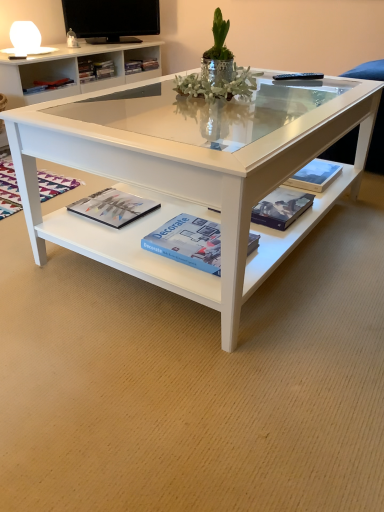
This screenshot has width=384, height=512. I want to click on matte black book at lower center, which is counted as the third magazine, starting from the left, so click(281, 208).

Describe the element at coordinates (190, 172) in the screenshot. Image resolution: width=384 pixels, height=512 pixels. I see `white glossy coffee table at center` at that location.

Where is `matte black book at center`? Image resolution: width=384 pixels, height=512 pixels. matte black book at center is located at coordinates pyautogui.click(x=47, y=85).

Find the location of a particular element. This screenshot has height=512, width=384. black glossy television at upper center is located at coordinates (112, 19).

The width and height of the screenshot is (384, 512). What do you see at coordinates (113, 207) in the screenshot? I see `matte black magazine at lower center, the second magazine viewed from the right` at bounding box center [113, 207].

What do you see at coordinates (315, 176) in the screenshot? I see `hardcover book at center, which appears as the 2th paperback book when viewed from the front` at bounding box center [315, 176].

Find the location of a particular element. Image resolution: width=384 pixels, height=512 pixels. matte black book at lower center, which is the 1th magazine from right to left is located at coordinates (281, 208).

Considering the positions of points (293, 194) and (223, 61), is point (293, 194) farther from camera compared to point (223, 61)?

That is True.

Is matte black book at lower center, which is counted as the third magazine, starting from the left, wider than silver metallic vase at center?

No, matte black book at lower center, which is counted as the third magazine, starting from the left, is not wider than silver metallic vase at center.

Can you confirm if matte black book at lower center, which is the 1th magazine from right to left, is positioned to the right of silver metallic vase at center?

Indeed, matte black book at lower center, which is the 1th magazine from right to left, is positioned on the right side of silver metallic vase at center.

Between matte black book at lower center, which is the 1th magazine from right to left, and silver metallic vase at center, which one has less height?

matte black book at lower center, which is the 1th magazine from right to left.

Is blue matte paperback book at center, placed as the first paperback book when sorted from bottom to top, oriented away from matte black magazine at lower center, the second magazine viewed from the right?

No.

Is blue matte paperback book at center, arranged as the 1th paperback book when viewed from the front, in front of or behind matte black magazine at lower center, the second magazine in the left-to-right sequence, in the image?

Clearly, blue matte paperback book at center, arranged as the 1th paperback book when viewed from the front, is in front of matte black magazine at lower center, the second magazine in the left-to-right sequence.

Can you tell me how much blue matte paperback book at center, placed as the first paperback book when sorted from bottom to top, and matte black magazine at lower center, the second magazine in the left-to-right sequence, differ in facing direction?

0.794 degrees separate the facing orientations of blue matte paperback book at center, placed as the first paperback book when sorted from bottom to top, and matte black magazine at lower center, the second magazine in the left-to-right sequence.

Can you confirm if black glossy television at upper center is shorter than blue matte paperback book at center, arranged as the 1th paperback book when viewed from the front?

In fact, black glossy television at upper center may be taller than blue matte paperback book at center, arranged as the 1th paperback book when viewed from the front.

From the image's perspective, which is below, black glossy television at upper center or blue matte paperback book at center, arranged as the 1th paperback book when viewed from the front?

blue matte paperback book at center, arranged as the 1th paperback book when viewed from the front.

Which is farther from the camera, (80, 15) or (165, 256)?

Point (80, 15)

Is black glossy television at upper center positioned behind blue matte paperback book at center, placed as the first paperback book when sorted from bottom to top?

Yes, the depth of black glossy television at upper center is greater than that of blue matte paperback book at center, placed as the first paperback book when sorted from bottom to top.

From a real-world perspective, is matte black magazine at lower left, which appears as the 3th magazine when viewed from the right, located beneath silver metallic vase at center?

Indeed, from a real-world perspective, matte black magazine at lower left, which appears as the 3th magazine when viewed from the right, is positioned beneath silver metallic vase at center.

Who is taller, matte black magazine at lower left, which is the 1th magazine in left-to-right order, or silver metallic vase at center?

silver metallic vase at center is taller.

Is there a large distance between matte black magazine at lower left, which is the 1th magazine in left-to-right order, and silver metallic vase at center?

Actually, matte black magazine at lower left, which is the 1th magazine in left-to-right order, and silver metallic vase at center are a little close together.

The image size is (384, 512). I want to click on floral arrangement above the matte black magazine at lower left, which appears as the 3th magazine when viewed from the right (from a real-world perspective), so click(218, 70).

Between matte black book at lower center, which is counted as the third magazine, starting from the left, and black glossy television at upper center, which one has less height?

matte black book at lower center, which is counted as the third magazine, starting from the left.

Considering their positions, is matte black book at lower center, which is the 1th magazine from right to left, located in front of or behind black glossy television at upper center?

In the image, matte black book at lower center, which is the 1th magazine from right to left, appears in front of black glossy television at upper center.

Does matte black book at lower center, which is the 1th magazine from right to left, have a lesser width compared to black glossy television at upper center?

No, matte black book at lower center, which is the 1th magazine from right to left, is not thinner than black glossy television at upper center.

Is matte black book at lower center, which is the 1th magazine from right to left, not close to black glossy television at upper center?

Yes.

Between matte black magazine at lower left, which appears as the 3th magazine when viewed from the right, and hardcover book at center, acting as the first paperback book starting from the right, which one has smaller size?

Smaller between the two is hardcover book at center, acting as the first paperback book starting from the right.

Between matte black magazine at lower left, which is the 1th magazine in left-to-right order, and hardcover book at center, which appears as the 2th paperback book when viewed from the front, which one appears on the left side from the viewer's perspective?

Positioned to the left is matte black magazine at lower left, which is the 1th magazine in left-to-right order.

Which point is more forward, (60,188) or (319,190)?

The point (319,190) is closer to the camera.

From a real-world perspective, is matte black magazine at lower left, which is the 1th magazine in left-to-right order, physically above hardcover book at center, the 2th paperback book from the left?

Incorrect, from a real-world perspective, matte black magazine at lower left, which is the 1th magazine in left-to-right order, is lower than hardcover book at center, the 2th paperback book from the left.

Is point (208, 72) more distant than point (311, 182)?

That is False.

Which of these two, silver metallic vase at center or hardcover book at center, acting as the first paperback book starting from the right, stands shorter?

hardcover book at center, acting as the first paperback book starting from the right.

Is silver metallic vase at center surrounding hardcover book at center, the 2th paperback book from the left?

No, hardcover book at center, the 2th paperback book from the left, is not surrounded by silver metallic vase at center.

Identify the location of magazine that is on the right side of silver metallic vase at center. The image size is (384, 512). (281, 208).

The width and height of the screenshot is (384, 512). In order to click on paperback book below the matte black magazine at lower center, the second magazine viewed from the right (from the image's perspective) in this screenshot , I will do `click(188, 242)`.

Looking at the image, which one is located closer to black glossy television at upper center, matte black book at center or silver metallic vase at center?

The object closer to black glossy television at upper center is matte black book at center.

Based on their spatial positions, is blue matte paperback book at center, arranged as the second paperback book when viewed from the top, or black glossy television at upper center closer to matte black magazine at lower center, the second magazine viewed from the right?

The object closer to matte black magazine at lower center, the second magazine viewed from the right, is blue matte paperback book at center, arranged as the second paperback book when viewed from the top.

Based on their spatial positions, is silver metallic vase at center or matte black book at lower center, which is the 1th magazine from right to left, further from blue matte paperback book at center, positioned as the 1th paperback book in left-to-right order?

silver metallic vase at center lies further to blue matte paperback book at center, positioned as the 1th paperback book in left-to-right order, than the other object.

Based on the photo, based on their spatial positions, is blue matte paperback book at center, placed as the first paperback book when sorted from bottom to top, or white glossy coffee table at center further from matte black magazine at lower center, the second magazine in the left-to-right sequence?

white glossy coffee table at center.

Estimate the real-world distances between objects in this image. Which object is closer to black glossy television at upper center, silver metallic vase at center or white glossy coffee table at center?

white glossy coffee table at center is positioned closer to the anchor black glossy television at upper center.

From the image, which object appears to be farther from hardcover book at center, the second paperback book when ordered from bottom to top, silver metallic vase at center or white glossy coffee table at center?

white glossy coffee table at center is positioned further to the anchor hardcover book at center, the second paperback book when ordered from bottom to top.

Looking at the image, which one is located further to silver metallic vase at center, hardcover book at center, acting as the first paperback book starting from the right, or blue matte paperback book at center, arranged as the 1th paperback book when viewed from the front?

blue matte paperback book at center, arranged as the 1th paperback book when viewed from the front, is further to silver metallic vase at center.

Considering their positions, is black glossy television at upper center positioned further to blue matte paperback book at center, arranged as the second paperback book when viewed from the top, than matte black magazine at lower center, the second magazine viewed from the right?

black glossy television at upper center is positioned further to the anchor blue matte paperback book at center, arranged as the second paperback book when viewed from the top.

The width and height of the screenshot is (384, 512). Find the location of `paperback book between silver metallic vase at center and blue matte paperback book at center, which ranks as the 2th paperback book in right-to-left order, in the vertical direction`. paperback book between silver metallic vase at center and blue matte paperback book at center, which ranks as the 2th paperback book in right-to-left order, in the vertical direction is located at coordinates (315, 176).

This screenshot has height=512, width=384. In order to click on magazine between matte black magazine at lower center, the second magazine in the left-to-right sequence, and matte black book at center, along the z-axis in this screenshot , I will do `click(8, 190)`.

This screenshot has width=384, height=512. Find the location of `magazine between black glossy television at upper center and matte black book at lower center, which is the 1th magazine from right to left, in the up-down direction`. magazine between black glossy television at upper center and matte black book at lower center, which is the 1th magazine from right to left, in the up-down direction is located at coordinates (8, 190).

The image size is (384, 512). I want to click on paperback book between matte black magazine at lower center, the second magazine in the left-to-right sequence, and matte black book at center, along the z-axis, so click(315, 176).